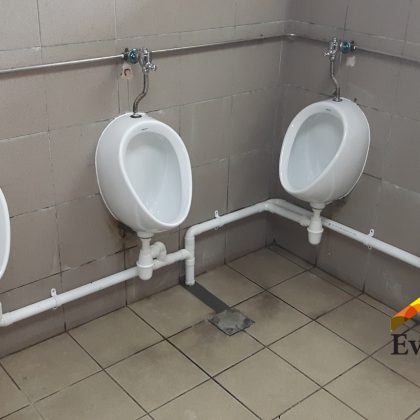
Where is `water pipes to flush urinals`? Image resolution: width=420 pixels, height=420 pixels. water pipes to flush urinals is located at coordinates (97, 288), (189, 278), (233, 219), (299, 211), (359, 236).